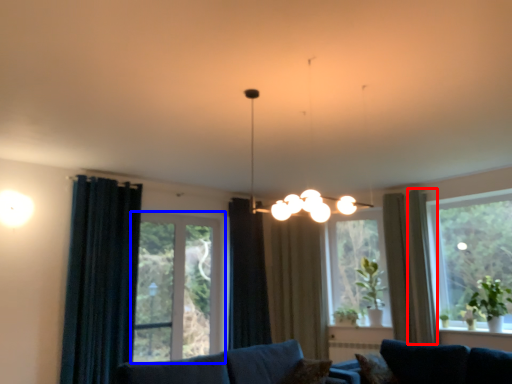
Question: Which point is further to the camera, curtain (highlighted by a red box) or window (highlighted by a blue box)?

Choices:
 (A) curtain
 (B) window

Answer: (A)